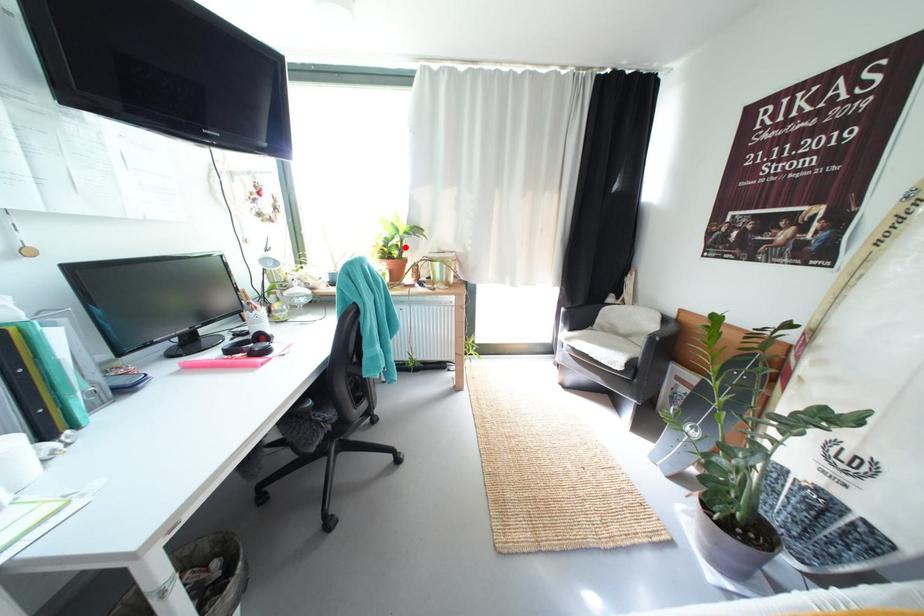
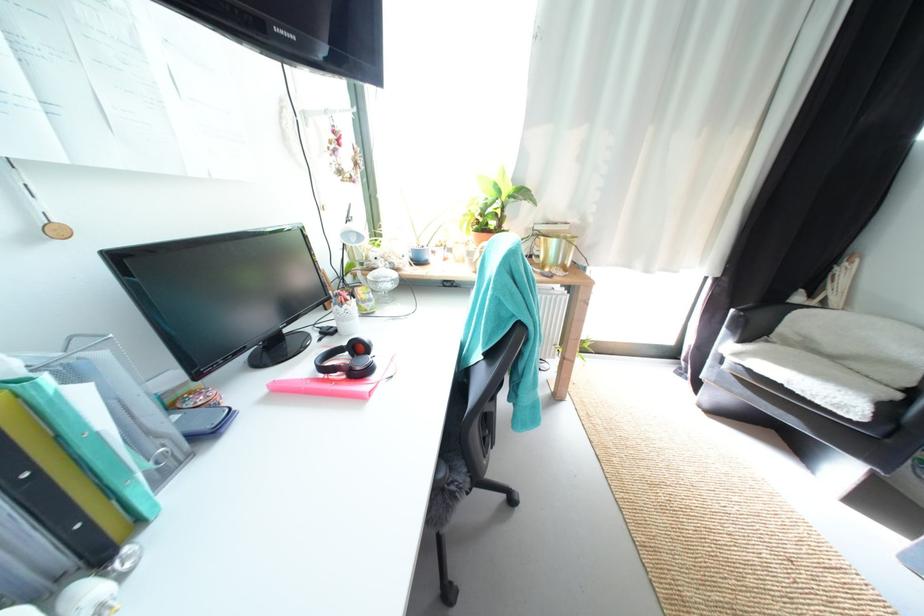
Locate, in the second image, the point that corresponds to the highlighted location in the first image.

(505, 216)